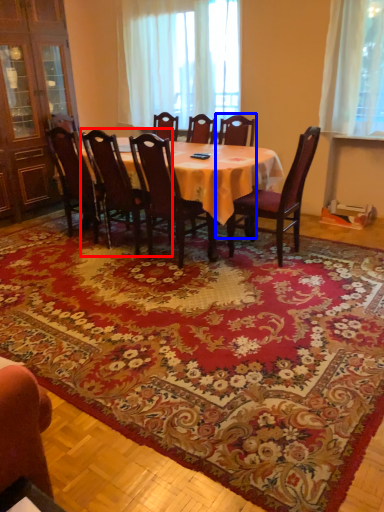
Question: Which object appears closest to the camera in this image, chair (highlighted by a red box) or chair (highlighted by a blue box)?

Choices:
 (A) chair
 (B) chair

Answer: (A)